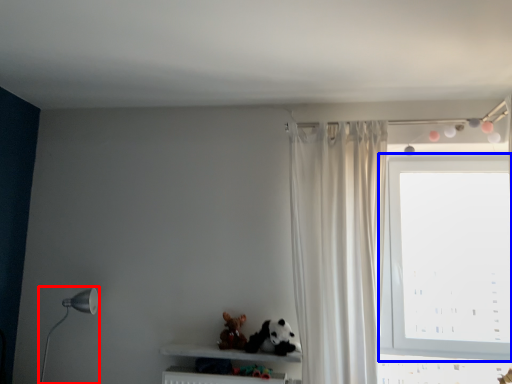
Question: Which of the following is the closest to the observer, table lamp (highlighted by a red box) or window (highlighted by a blue box)?

Choices:
 (A) table lamp
 (B) window

Answer: (A)